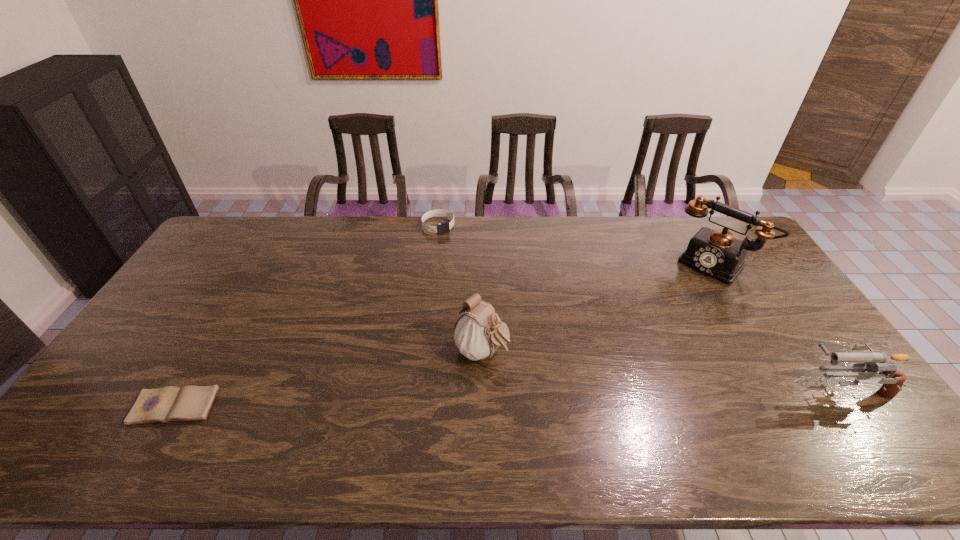
You are a GUI agent. You are given a task and a screenshot of the screen. Output one action in this format:
    pyautogui.click(x=<x>, y=<y>)
    Task: Click on the blank space that satisfies the following two spatial constraints: 1. on the front side of the telephone; 2. at the barrel end of the gun
    The image size is (960, 540).
    Given the screenshot: What is the action you would take?
    pyautogui.click(x=793, y=388)

Find the location of a particular element. blank space that satisfies the following two spatial constraints: 1. on the front side of the farthest object; 2. on the right side of the third object from left to right is located at coordinates (423, 352).